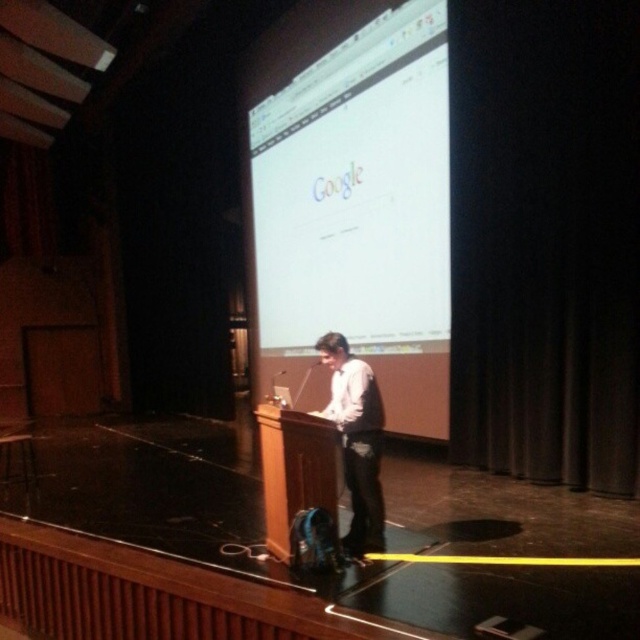
You are an event organizer who needs to ensure that all participants can see the presentation clearly. Considering the white glossy projector screen at center and the light brown shirt at center, which object is larger and would be more visible from the back of the room?

The white glossy projector screen at center is bigger than the light brown shirt at center, so it would be more visible from the back of the room.

You are an attendee sitting in the front row of the lecture hall. You want to take a photo of the white glossy projector screen at center. Where should you aim your camera to capture it perfectly?

You should aim your camera at point (x=356, y=192) to capture the white glossy projector screen at center perfectly.